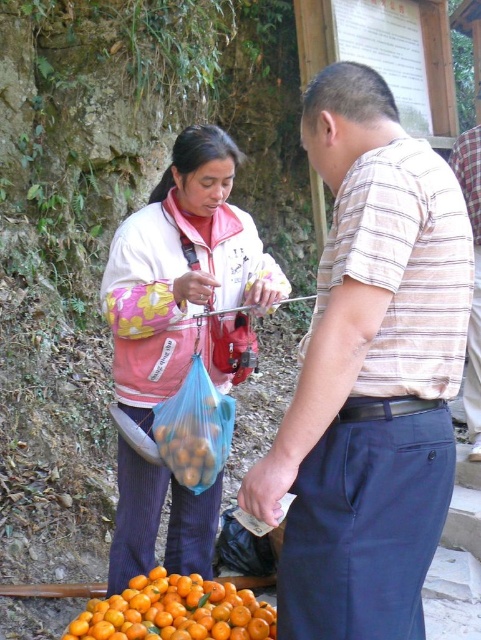
Question: Which object is farther from the camera taking this photo?

Choices:
 (A) striped cotton shirt at center
 (B) pink fabric jacket at center

Answer: (B)

Question: Which of these objects is positioned farthest from the pink fabric jacket at center?

Choices:
 (A) striped cotton shirt at center
 (B) orange matte fruit at lower center

Answer: (A)

Question: Is striped cotton shirt at center further to camera compared to pink fabric jacket at center?

Choices:
 (A) no
 (B) yes

Answer: (A)

Question: Can you confirm if pink fabric jacket at center is positioned below orange matte fruit at lower center?

Choices:
 (A) yes
 (B) no

Answer: (B)

Question: Does striped cotton shirt at center have a greater width compared to pink fabric jacket at center?

Choices:
 (A) yes
 (B) no

Answer: (B)

Question: Which point is farther to the camera?

Choices:
 (A) striped cotton shirt at center
 (B) orange matte fruit at lower center
 (C) pink fabric jacket at center

Answer: (C)